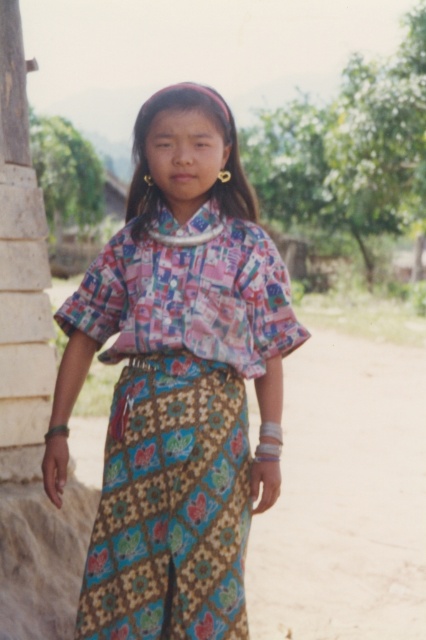
Between printed fabric blouse at center and brown dirt field at lower center, which one has more height?

printed fabric blouse at center is taller.

Is printed fabric blouse at center above brown dirt field at lower center?

Yes, printed fabric blouse at center is above brown dirt field at lower center.

The image size is (426, 640). What do you see at coordinates (178, 381) in the screenshot? I see `printed fabric blouse at center` at bounding box center [178, 381].

Where is `printed fabric blouse at center`? This screenshot has height=640, width=426. printed fabric blouse at center is located at coordinates (178, 381).